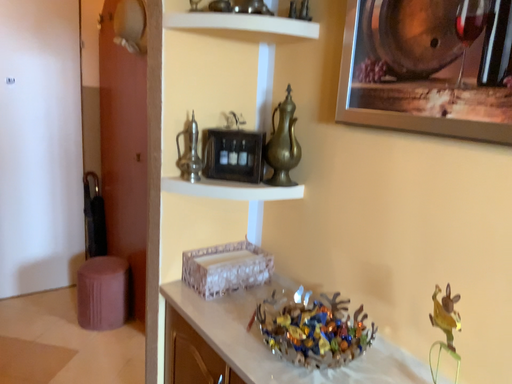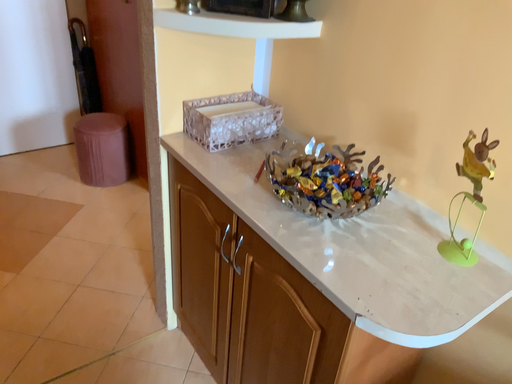
Question: Which way did the camera rotate in the video?

Choices:
 (A) rotated downward
 (B) rotated upward

Answer: (A)